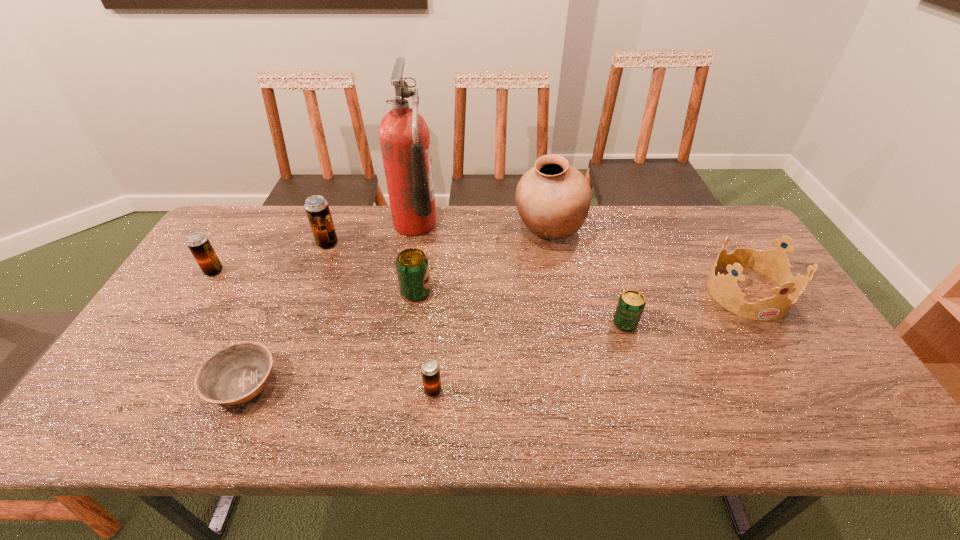
This screenshot has height=540, width=960. I want to click on vacant area situated on the back of the leftmost black beer can, so click(254, 208).

This screenshot has width=960, height=540. In order to click on free space located on the left of the third farthest beer can in this screenshot , I will do `click(300, 292)`.

Where is `vacant space situated on the right of the nearer green beer can`? The image size is (960, 540). vacant space situated on the right of the nearer green beer can is located at coordinates 738,323.

The width and height of the screenshot is (960, 540). I want to click on blank area located 0.300m on the back of the smallest black beer can, so click(442, 292).

Where is `free location located on the left of the shortest object`? free location located on the left of the shortest object is located at coordinates (161, 384).

Where is `fire extinguisher that is positioned at the far edge`? The height and width of the screenshot is (540, 960). fire extinguisher that is positioned at the far edge is located at coordinates (404, 137).

This screenshot has height=540, width=960. I want to click on pottery situated at the far edge, so tap(553, 198).

The image size is (960, 540). What are the coordinates of `beer can positioned at the far edge` in the screenshot? It's located at (317, 209).

Where is `object at the near edge`? Image resolution: width=960 pixels, height=540 pixels. object at the near edge is located at coordinates (235, 374).

The height and width of the screenshot is (540, 960). I want to click on object at the left edge, so click(198, 243).